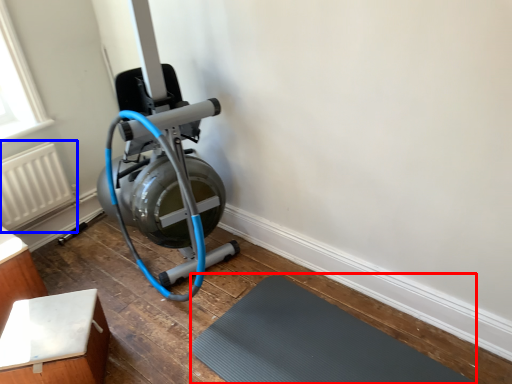
Question: Among these objects, which one is nearest to the camera, bath mat (highlighted by a red box) or radiator (highlighted by a blue box)?

Choices:
 (A) bath mat
 (B) radiator

Answer: (A)